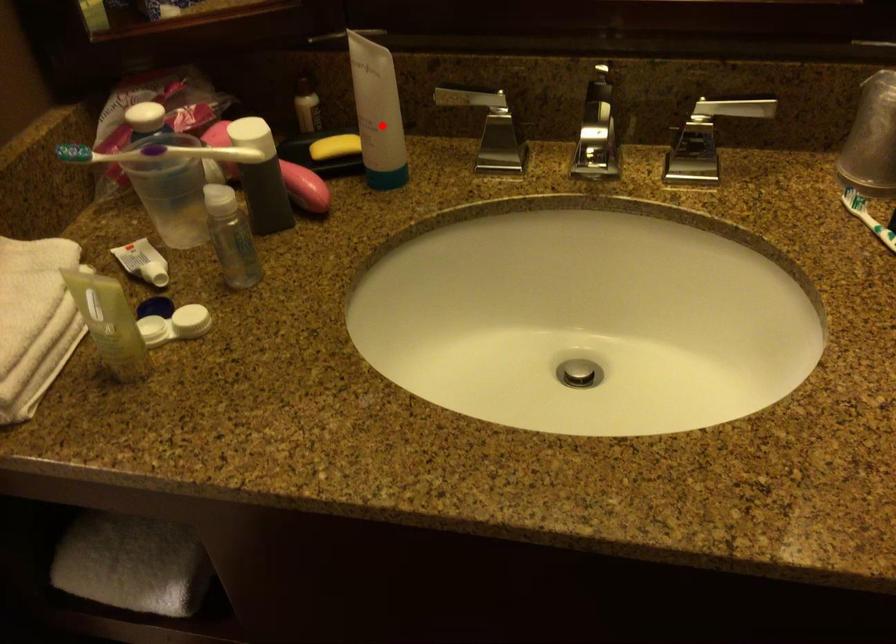
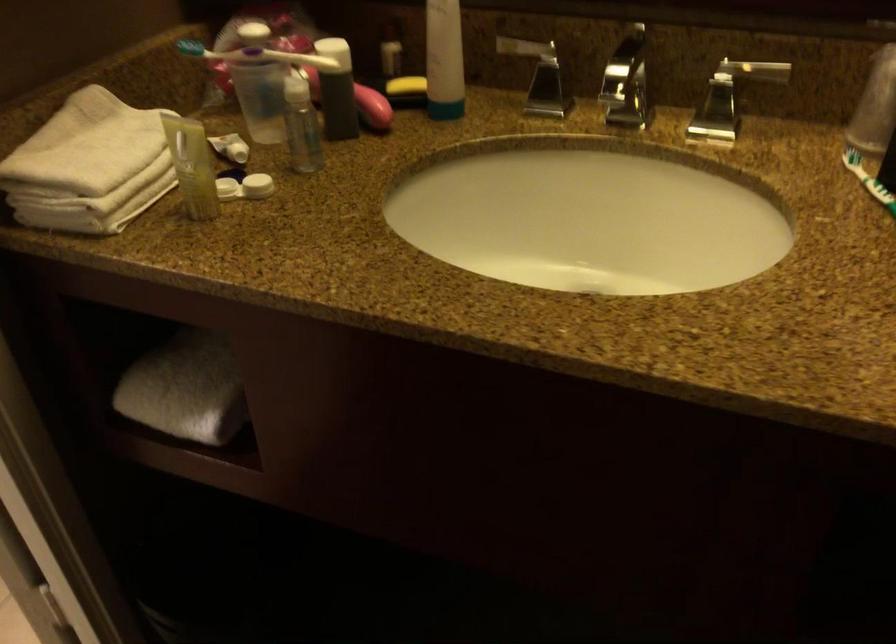
Question: I am providing you with two images of the same scene from different viewpoints. A red point is shown in image1. For the corresponding object point in image2, is it positioned nearer or farther from the camera?

Choices:
 (A) Nearer
 (B) Farther

Answer: (B)